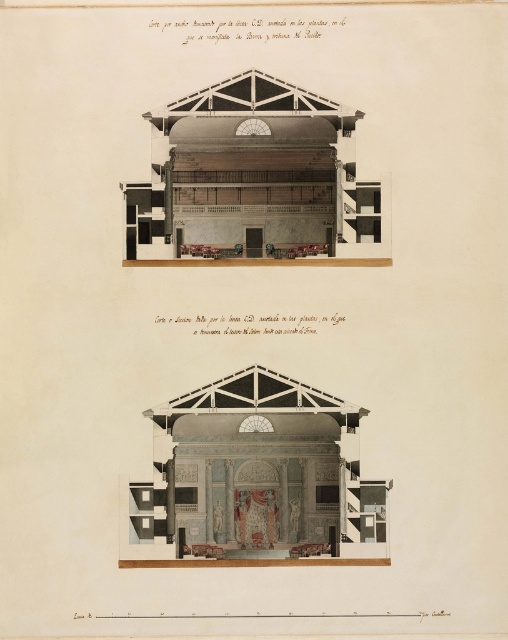
In the top section of the theater cross section drawing, where is the matte gray marble stage at center located?

The matte gray marble stage at center is located at point [254,480].

Based on the cross section of the theater, which object occupies more space in the center area between the matte gray marble stage at center and the wooden paneling at center?

The matte gray marble stage at center occupies more space in the center area than the wooden paneling at center.

You are an architect reviewing the theater cross section. The stage and wooden paneling are both at the center. How far apart are the matte gray marble stage at center and the wooden paneling at center?

The matte gray marble stage at center and wooden paneling at center are 24.37 feet apart.